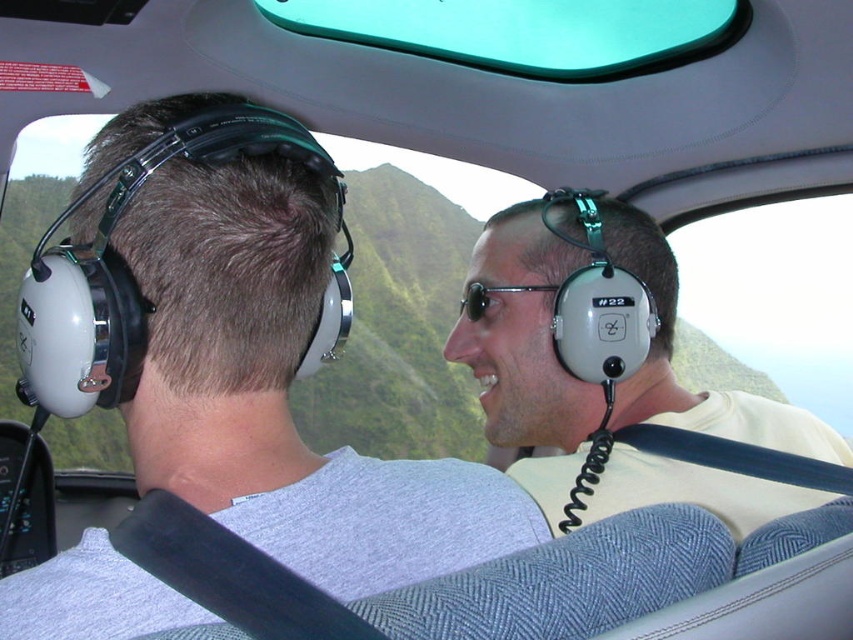
You are a flight attendant checking the safety equipment in the cockpit. You need to place both the gray matte headset at center and the black plastic sunglasses at center into a storage compartment that can only accommodate items up to 15 cm in height. Which item might not fit if the height limit is strictly enforced?

The gray matte headset at center is taller than the black plastic sunglasses at center, so the gray matte headset at center might not fit into the storage compartment if the height limit is strictly enforced.

You are a passenger on the aircraft and want to put on the gray matte headset at center and the black plastic sunglasses at center. Which one should you pick up first to reach the one closer to you?

The gray matte headset at center is closer to the viewer than the black plastic sunglasses at center, so you should pick up the gray matte headset at center first.

You are a flight attendant checking the safety equipment in the cockpit. You notice the gray matte headset at center and the black plastic sunglasses at center. Which item takes up more space in the cockpit?

Answer: The gray matte headset at center is larger in size than the black plastic sunglasses at center, so it takes up more space in the cockpit.